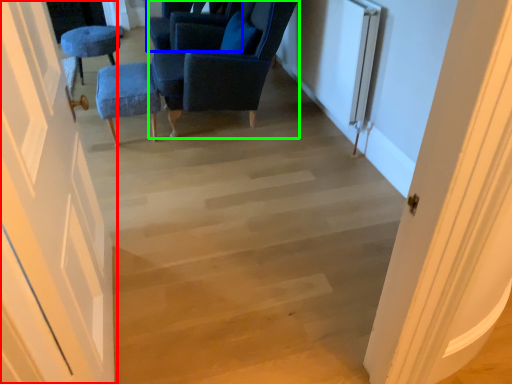
Question: Which is nearer to the door (highlighted by a red box)? chair (highlighted by a blue box) or chair (highlighted by a green box).

Choices:
 (A) chair
 (B) chair

Answer: (B)